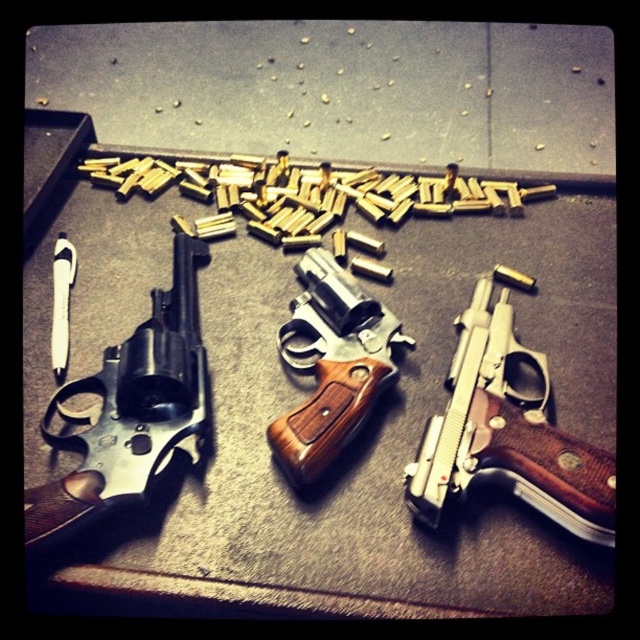
Question: Is polished silver revolver at center above polished silver revolver at left?

Choices:
 (A) yes
 (B) no

Answer: (B)

Question: Which object is positioned farthest from the wooden-handled revolver at center?

Choices:
 (A) polished silver revolver at left
 (B) polished silver revolver at center

Answer: (A)

Question: Can you confirm if polished silver revolver at center is positioned to the right of wooden-handled revolver at center?

Choices:
 (A) yes
 (B) no

Answer: (A)

Question: Which point is farther to the camera?

Choices:
 (A) polished silver revolver at left
 (B) polished silver revolver at center
 (C) wooden-handled revolver at center

Answer: (C)

Question: Which object is closer to the camera taking this photo?

Choices:
 (A) wooden-handled revolver at center
 (B) polished silver revolver at center

Answer: (B)

Question: Is polished silver revolver at left to the left of wooden-handled revolver at center from the viewer's perspective?

Choices:
 (A) no
 (B) yes

Answer: (B)